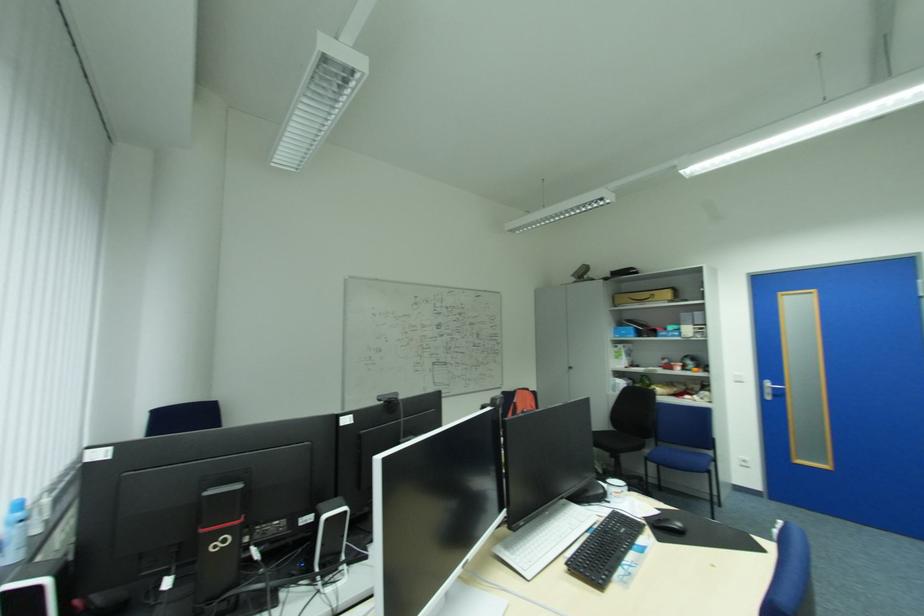
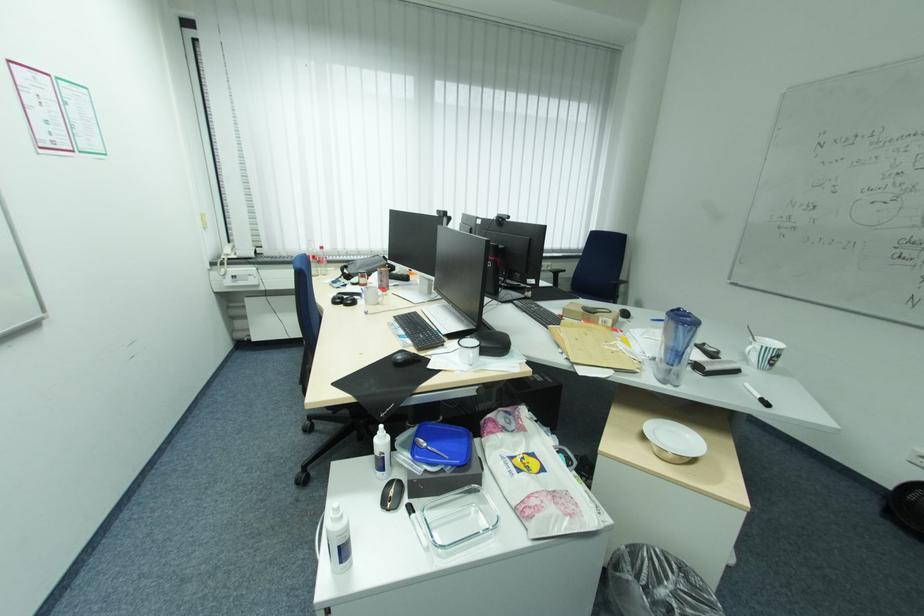
The point at (379, 314) is marked in the first image. Where is the corresponding point in the second image?

(827, 144)